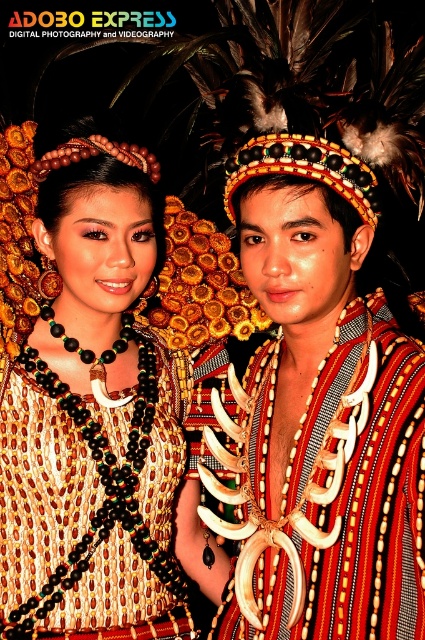
Question: Is black beaded necklace at center further to the viewer compared to shiny gold necklace at center?

Choices:
 (A) yes
 (B) no

Answer: (A)

Question: Which object appears closest to the camera in this image?

Choices:
 (A) black beaded necklace at center
 (B) shiny gold necklace at center

Answer: (B)

Question: Among these objects, which one is farthest from the camera?

Choices:
 (A) black beaded necklace at center
 (B) shiny gold necklace at center

Answer: (A)

Question: Does black beaded necklace at center appear on the left side of shiny gold necklace at center?

Choices:
 (A) no
 (B) yes

Answer: (B)

Question: Which point is farther to the camera?

Choices:
 (A) shiny gold necklace at center
 (B) black beaded necklace at center

Answer: (B)

Question: Is black beaded necklace at center below shiny gold necklace at center?

Choices:
 (A) no
 (B) yes

Answer: (A)